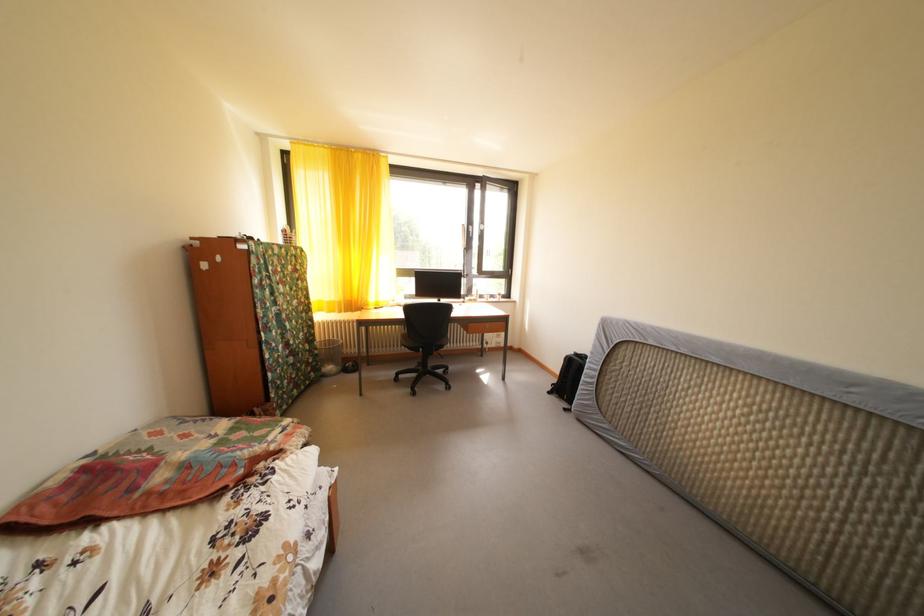
Where is `black window handle`? The width and height of the screenshot is (924, 616). black window handle is located at coordinates (466, 236).